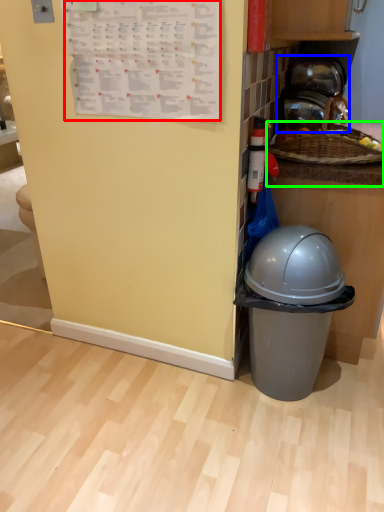
Question: Based on their relative distances, which object is nearer to writing (highlighted by a red box)? Choose from appliance (highlighted by a blue box) and counter top (highlighted by a green box).

Choices:
 (A) appliance
 (B) counter top

Answer: (B)